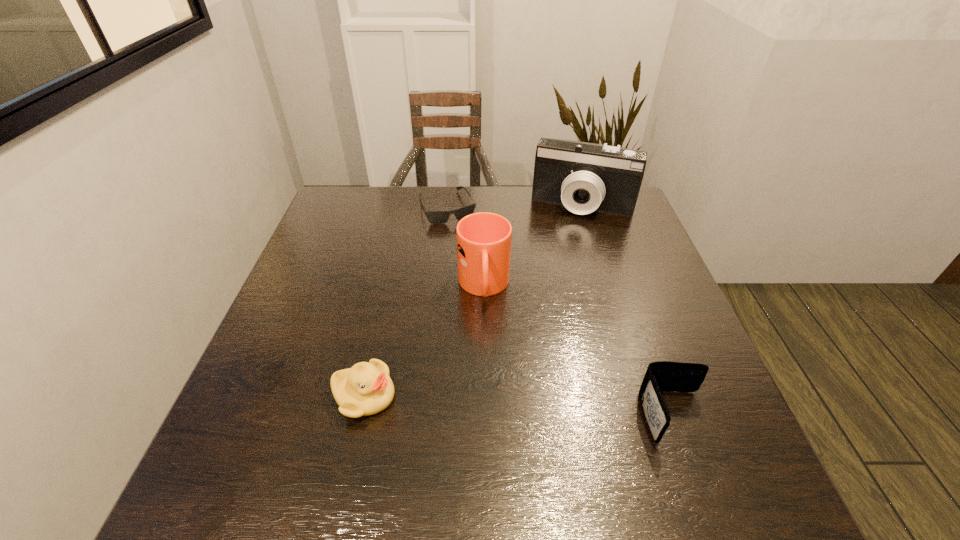
Where is `vacant space on the desktop that is between the duckling and the wallet and is positioned on the front-facing side of the shortest object`? This screenshot has height=540, width=960. vacant space on the desktop that is between the duckling and the wallet and is positioned on the front-facing side of the shortest object is located at coordinates (538, 407).

What are the coordinates of `free space on the desktop that is between the duckling and the wallet and is positioned on the lens of the tallest object` in the screenshot? It's located at (527, 407).

Find the location of a particular element. This screenshot has width=960, height=540. free spot on the desktop that is between the duckling and the wallet and is positioned on the handle side of the second tallest object is located at coordinates tap(498, 404).